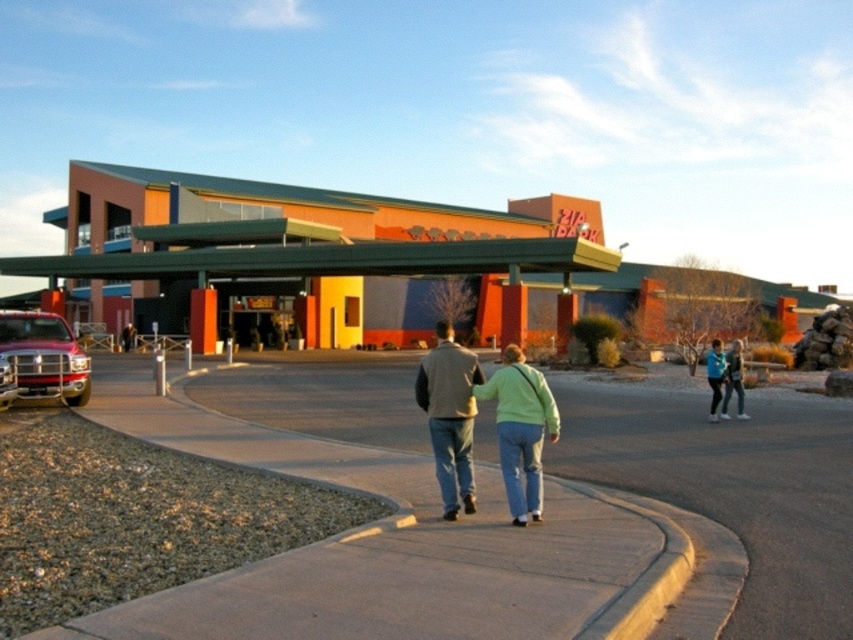
You are a delivery driver who needs to park your metallic red truck at left as close as possible to the light green sweater at center without blocking the sidewalk. The parking space allows you to park up to 20 feet away from the sweater. Can you park your truck within the allowed distance?

The distance between the light green sweater at center and the metallic red truck at left is 38.35 feet, which exceeds the 20 feet parking restriction. Therefore, you cannot park the metallic red truck at left within the allowed distance.

You are planning to place a large sculpture in the area between the concrete at center and the orange matte building at center. Based on their sizes, which object should the sculpture be placed closer to?

The sculpture should be placed closer to the orange matte building at center because the concrete at center is smaller in size, making the orange matte building at center a more suitable location for a larger sculpture.